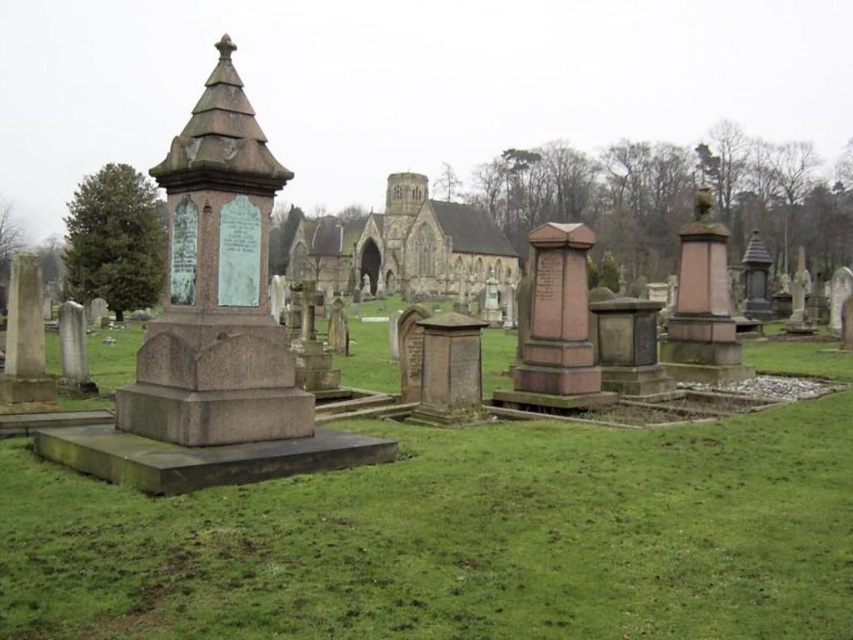
Who is taller, green grass at center or brown stone church at center?

brown stone church at center is taller.

Is point (836, 541) behind point (300, 246)?

That is False.

Find the location of a particular element. The width and height of the screenshot is (853, 640). green grass at center is located at coordinates [457, 540].